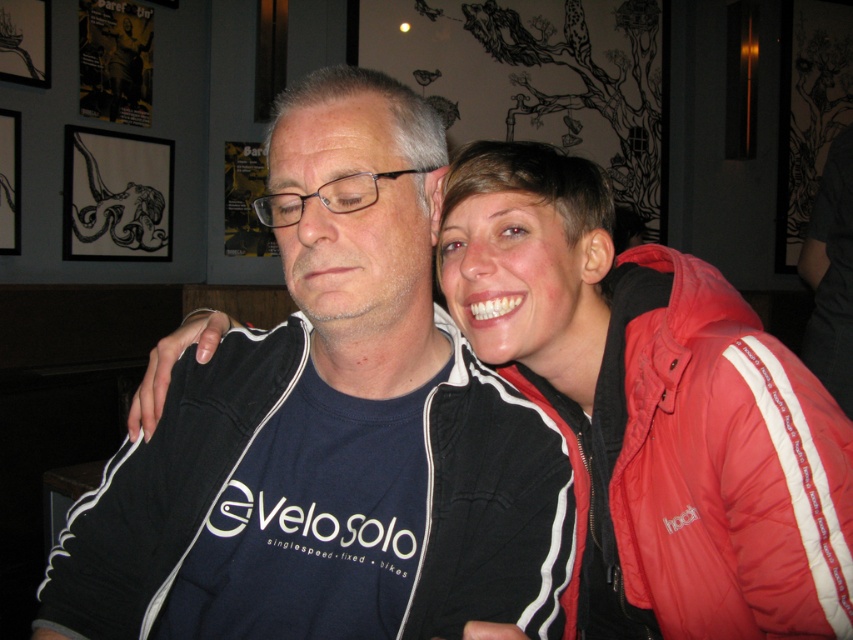
Which is more to the left, black matte jacket at center or red puffy jacket at right?

black matte jacket at center is more to the left.

Who is more forward, (299,83) or (718,468)?

Point (718,468) is in front.

Locate an element on the screen. Image resolution: width=853 pixels, height=640 pixels. black matte jacket at center is located at coordinates (329, 429).